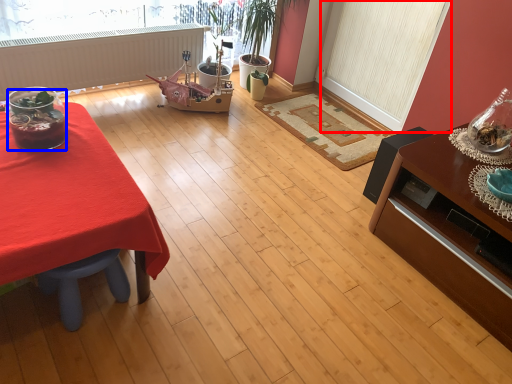
Question: Which object is further to the camera taking this photo, screen door (highlighted by a red box) or food (highlighted by a blue box)?

Choices:
 (A) screen door
 (B) food

Answer: (A)